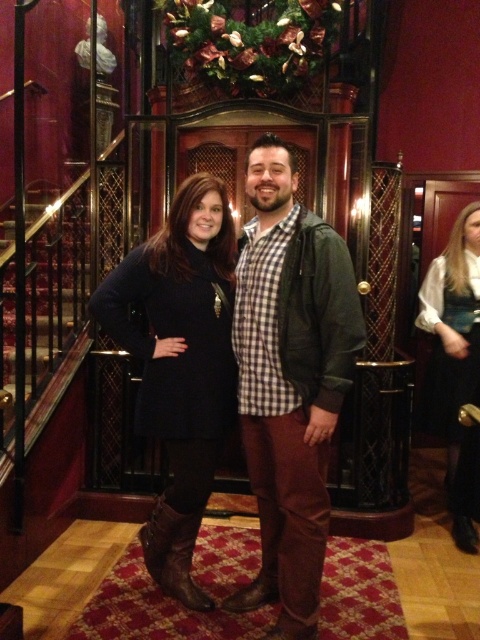
Question: Which point appears closest to the camera in this image?

Choices:
 (A) (184, 246)
 (B) (168, 586)
 (C) (316, 552)
 (D) (467, 317)

Answer: (C)

Question: Can you confirm if green matte jacket at center is positioned to the left of black satin dress at right?

Choices:
 (A) no
 (B) yes

Answer: (B)

Question: Is green matte jacket at center closer to the viewer compared to matte black coat at center?

Choices:
 (A) no
 (B) yes

Answer: (B)

Question: From the image, what is the correct spatial relationship of green matte jacket at center in relation to black satin dress at right?

Choices:
 (A) left
 (B) right

Answer: (A)

Question: Which object is farther from the camera taking this photo?

Choices:
 (A) matte black coat at center
 (B) green matte jacket at center
 (C) brown leather boot at lower center

Answer: (C)

Question: Among these points, which one is nearest to the camera?

Choices:
 (A) (153, 566)
 (B) (172, 243)

Answer: (B)